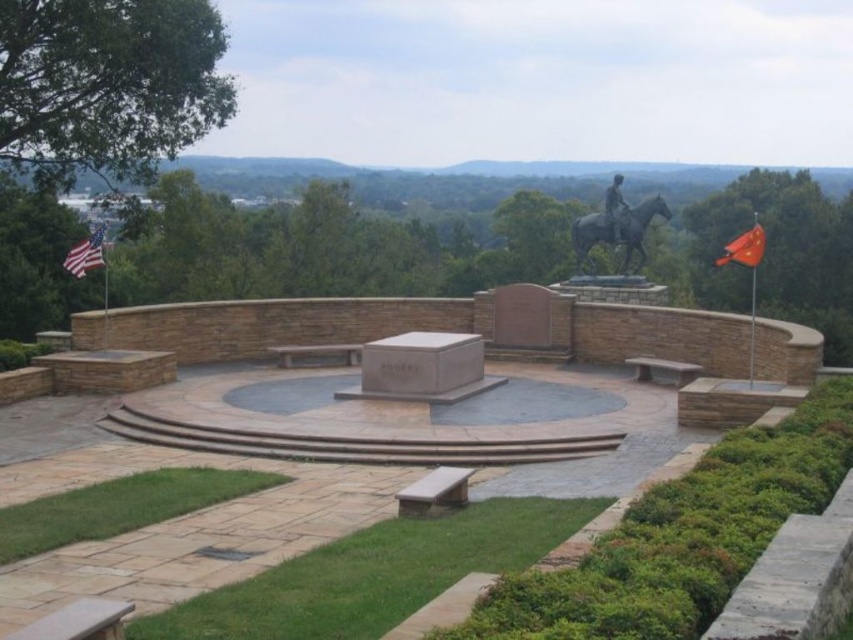
Question: Which object is the farthest from the american flag at left?

Choices:
 (A) brown stone amphitheater at center
 (B) polished bronze statue at upper right
 (C) bronze statue at center
 (D) red fabric flag at right

Answer: (D)

Question: Which point is farther to the camera?

Choices:
 (A) bronze statue at center
 (B) brown stone amphitheater at center

Answer: (A)

Question: Which point appears farthest from the camera in this image?

Choices:
 (A) (618, 211)
 (B) (503, 339)

Answer: (A)

Question: Does bronze statue at center lie in front of polished bronze statue at upper right?

Choices:
 (A) yes
 (B) no

Answer: (B)

Question: Does bronze statue at center lie in front of red fabric flag at right?

Choices:
 (A) no
 (B) yes

Answer: (A)

Question: Can you confirm if brown stone amphitheater at center is positioned to the right of red fabric flag at right?

Choices:
 (A) yes
 (B) no

Answer: (B)